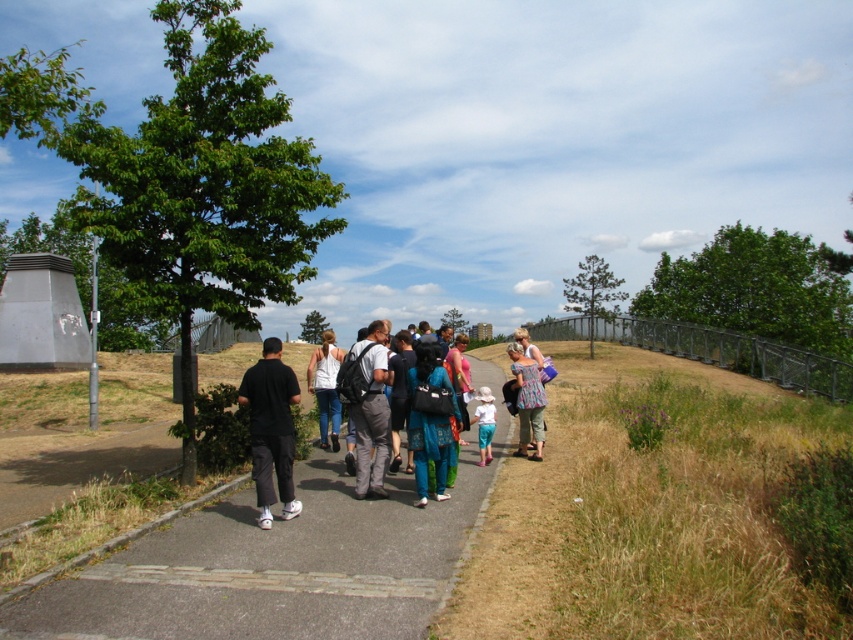
Is black matte pants at center smaller than blue fabric dress at center?

Yes, black matte pants at center is smaller than blue fabric dress at center.

Is point (274, 458) positioned behind point (425, 406)?

No, it is in front of (425, 406).

Where is `black matte pants at center`? The height and width of the screenshot is (640, 853). black matte pants at center is located at coordinates (271, 429).

Between matte black backpack at center and white cotton tank top at center, which one appears on the right side from the viewer's perspective?

From the viewer's perspective, matte black backpack at center appears more on the right side.

Who is more forward, (368, 464) or (312, 387)?

Point (368, 464) is in front.

Which is in front, point (375, 449) or point (323, 445)?

Point (375, 449) is more forward.

You are a GUI agent. You are given a task and a screenshot of the screen. Output one action in this format:
    pyautogui.click(x=<x>, y=<y>)
    Task: Click on the matte black backpack at center
    
    Given the screenshot: What is the action you would take?
    pyautogui.click(x=370, y=413)

Does point (260, 577) come behind point (532, 452)?

No, it is not.

Is smooth asphalt sidewalk at center closer to camera compared to floral fabric dress at center?

Yes, smooth asphalt sidewalk at center is in front of floral fabric dress at center.

Image resolution: width=853 pixels, height=640 pixels. What do you see at coordinates (271, 566) in the screenshot?
I see `smooth asphalt sidewalk at center` at bounding box center [271, 566].

The image size is (853, 640). I want to click on smooth asphalt sidewalk at center, so click(x=271, y=566).